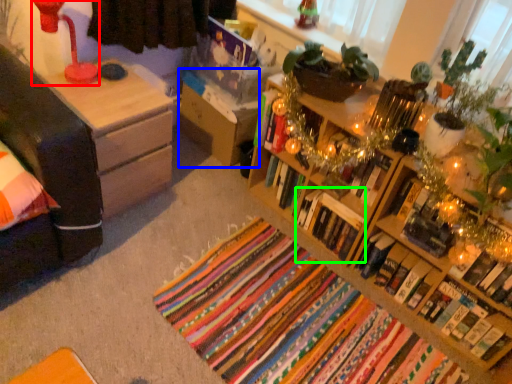
Question: Which object is the farthest from lamp (highlighted by a red box)? Choose among these: nightstand (highlighted by a blue box) or book (highlighted by a green box).

Choices:
 (A) nightstand
 (B) book

Answer: (B)